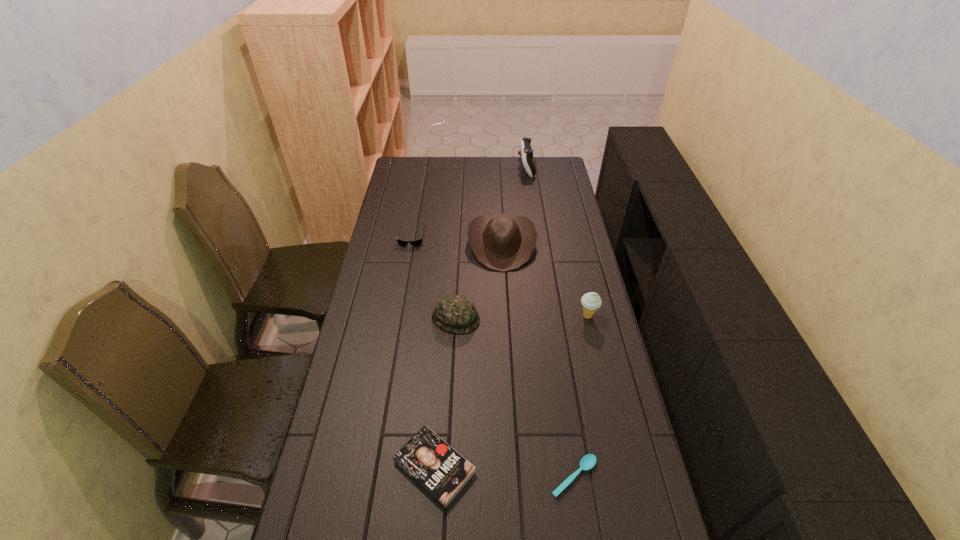
Locate an element on the screen. This screenshot has width=960, height=540. control is located at coordinates (526, 152).

Find the location of a particular element. The height and width of the screenshot is (540, 960). cowboy hat is located at coordinates (502, 242).

Where is `icecream`? icecream is located at coordinates (x=591, y=301).

Find the location of a particular element. The height and width of the screenshot is (540, 960). the fourth tallest object is located at coordinates (454, 313).

Find the location of `the leftmost object`. the leftmost object is located at coordinates (416, 242).

This screenshot has width=960, height=540. What are the coordinates of `sunglasses` in the screenshot? It's located at (416, 242).

The image size is (960, 540). What are the coordinates of `the sixth tallest object` in the screenshot? It's located at (440, 470).

Where is `spoon`? spoon is located at coordinates (588, 461).

You are a GUI agent. You are given a task and a screenshot of the screen. Output one action in this format:
    pyautogui.click(x=<x>, y=<y>)
    Task: Click on the free region located on the front-facing side of the control
    
    Given the screenshot: What is the action you would take?
    pyautogui.click(x=468, y=168)

Find the location of `vacant space located on the front-facing side of the control`. vacant space located on the front-facing side of the control is located at coordinates (468, 168).